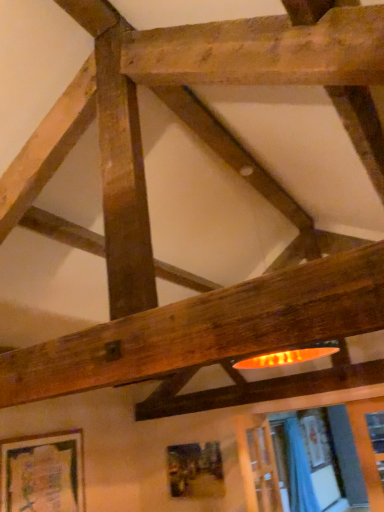
Question: From the image's perspective, does blue fabric curtain at lower right appear higher than wooden textured picture frame at lower center, which is the 1th picture frame from right to left?

Choices:
 (A) yes
 (B) no

Answer: (B)

Question: Considering the relative positions of blue fabric curtain at lower right and wooden textured picture frame at lower center, which is the 1th picture frame from back to front, in the image provided, is blue fabric curtain at lower right in front of wooden textured picture frame at lower center, which is the 1th picture frame from back to front,?

Choices:
 (A) no
 (B) yes

Answer: (A)

Question: From a real-world perspective, is blue fabric curtain at lower right under wooden textured picture frame at lower center, acting as the second picture frame starting from the left?

Choices:
 (A) no
 (B) yes

Answer: (B)

Question: Can you confirm if blue fabric curtain at lower right is thinner than wooden textured picture frame at lower center, arranged as the 2th picture frame when viewed from the front?

Choices:
 (A) no
 (B) yes

Answer: (A)

Question: Considering the relative positions of blue fabric curtain at lower right and wooden textured picture frame at lower center, acting as the second picture frame starting from the left, in the image provided, is blue fabric curtain at lower right to the right of wooden textured picture frame at lower center, acting as the second picture frame starting from the left, from the viewer's perspective?

Choices:
 (A) no
 (B) yes

Answer: (B)

Question: Looking at their shapes, would you say wooden frame at lower left, which is the second picture frame in back-to-front order, is wider or thinner than wooden textured picture frame at lower center, arranged as the 2th picture frame when viewed from the front?

Choices:
 (A) wide
 (B) thin

Answer: (A)

Question: Considering the positions of wooden frame at lower left, placed as the second picture frame when sorted from right to left, and wooden textured picture frame at lower center, which is the 1th picture frame from back to front, in the image, is wooden frame at lower left, placed as the second picture frame when sorted from right to left, bigger or smaller than wooden textured picture frame at lower center, which is the 1th picture frame from back to front,?

Choices:
 (A) big
 (B) small

Answer: (A)

Question: Does point (31, 510) appear closer or farther from the camera than point (203, 479)?

Choices:
 (A) closer
 (B) farther

Answer: (A)

Question: In terms of height, does wooden frame at lower left, placed as the second picture frame when sorted from right to left, look taller or shorter compared to wooden textured picture frame at lower center, which is the 1th picture frame from right to left?

Choices:
 (A) short
 (B) tall

Answer: (B)

Question: From a real-world perspective, is wooden frame at lower left, acting as the 1th picture frame starting from the left, above or below blue fabric curtain at lower right?

Choices:
 (A) above
 (B) below

Answer: (A)

Question: From the image's perspective, relative to blue fabric curtain at lower right, is wooden frame at lower left, the 1th picture frame positioned from the front, above or below?

Choices:
 (A) below
 (B) above

Answer: (B)

Question: Does point (64, 440) appear closer or farther from the camera than point (301, 456)?

Choices:
 (A) farther
 (B) closer

Answer: (B)

Question: Is wooden frame at lower left, the 1th picture frame positioned from the front, wider or thinner than blue fabric curtain at lower right?

Choices:
 (A) wide
 (B) thin

Answer: (B)

Question: In the image, is blue fabric curtain at lower right positioned in front of or behind wooden frame at lower left, acting as the 1th picture frame starting from the left?

Choices:
 (A) behind
 (B) front

Answer: (A)

Question: Looking at the image, does blue fabric curtain at lower right seem bigger or smaller compared to wooden frame at lower left, placed as the second picture frame when sorted from right to left?

Choices:
 (A) small
 (B) big

Answer: (B)